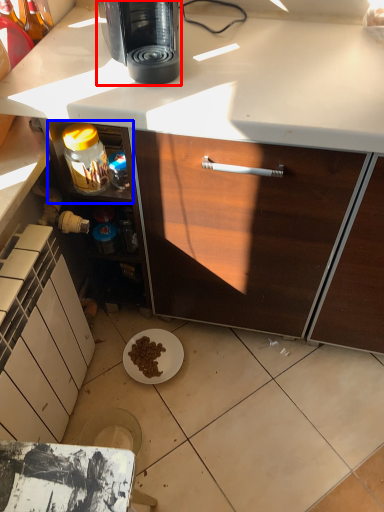
Question: Which object is closer to the camera taking this photo, coffee maker (highlighted by a red box) or shelf (highlighted by a blue box)?

Choices:
 (A) coffee maker
 (B) shelf

Answer: (A)